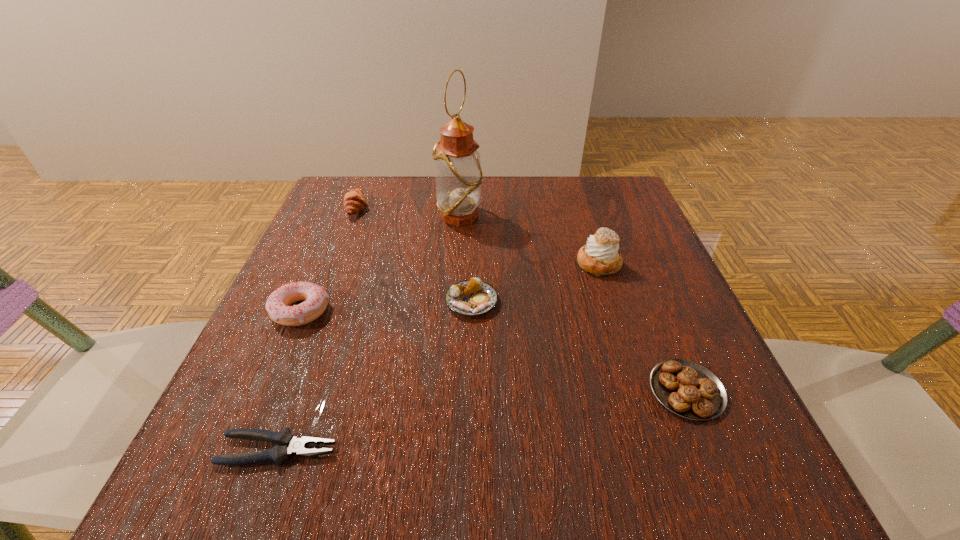
Locate an element on the screen. This screenshot has height=540, width=960. vacant region located on the back of the tallest object is located at coordinates (462, 191).

Identify the location of free location located 0.320m on the front of the sixth shortest object. (651, 427).

The height and width of the screenshot is (540, 960). I want to click on free space located on the front-facing side of the leftmost pastry, so click(397, 208).

Locate an element on the screen. The width and height of the screenshot is (960, 540). vacant space situated on the right of the doughnut is located at coordinates (379, 311).

Where is `vacant space situated on the right of the second pastry from left to right`? vacant space situated on the right of the second pastry from left to right is located at coordinates (558, 302).

Locate an element on the screen. vacant area situated 0.230m on the back of the nearest pastry is located at coordinates (636, 269).

Identify the location of free space located at the gripping part of the shortest object. The width and height of the screenshot is (960, 540). (528, 450).

Identify the location of oil lamp situated at the far edge. (458, 171).

At what (x,y) coordinates should I click in order to perform the action: click on pastry located at the far edge. Please return your answer as a coordinate pair (x, y). Looking at the image, I should click on (354, 201).

Find the location of `object at the near edge`. object at the near edge is located at coordinates (289, 445).